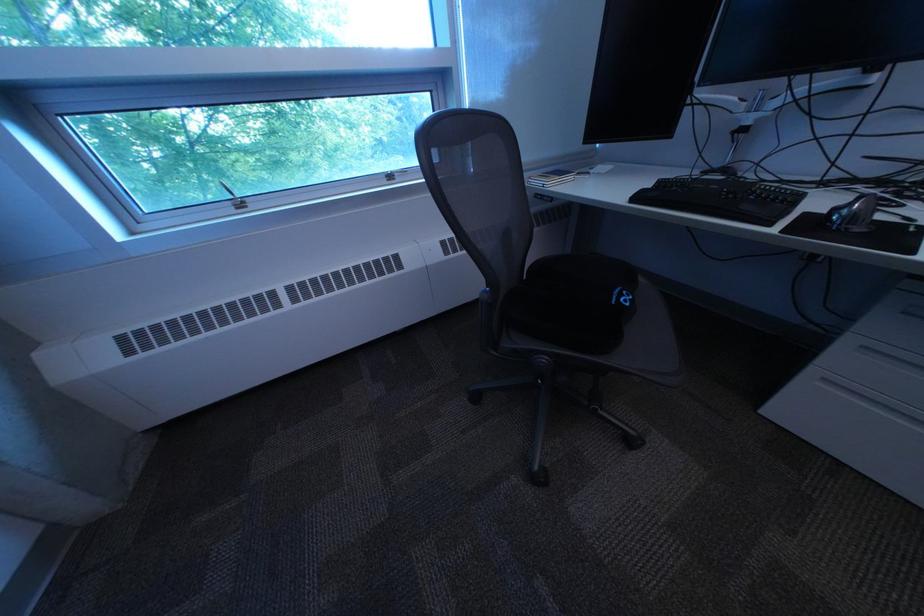
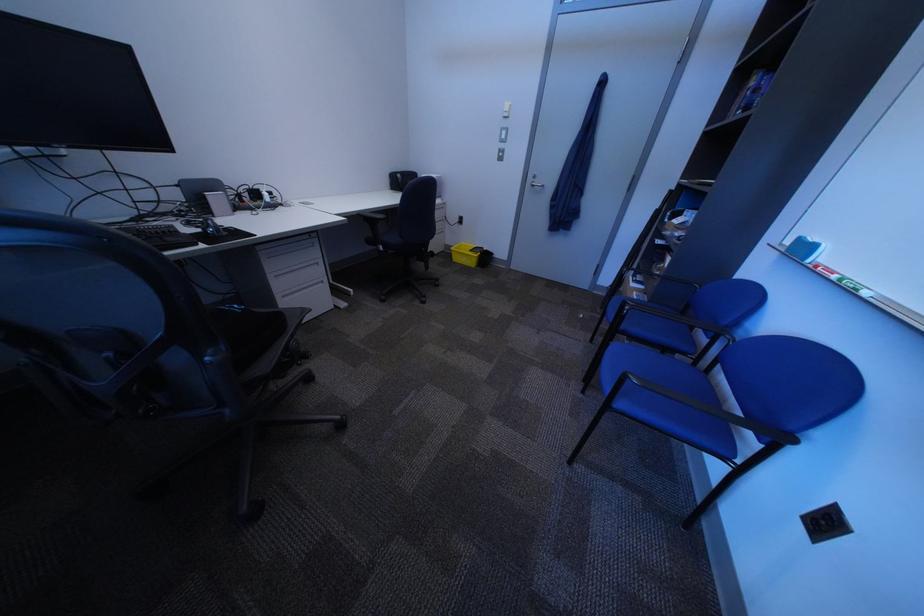
Find the pixel in the second image that matches [841,212] in the first image.

(214, 232)